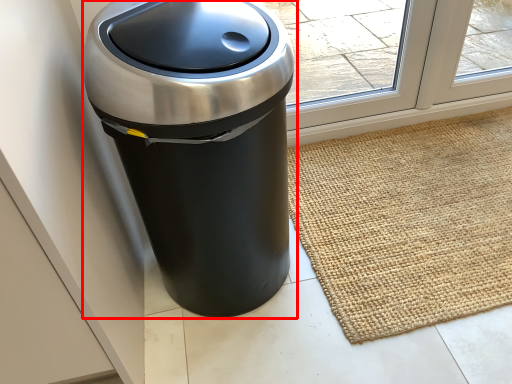
Question: Where is waste container (annotated by the red box) located in relation to doormat in the image?

Choices:
 (A) left
 (B) right

Answer: (A)